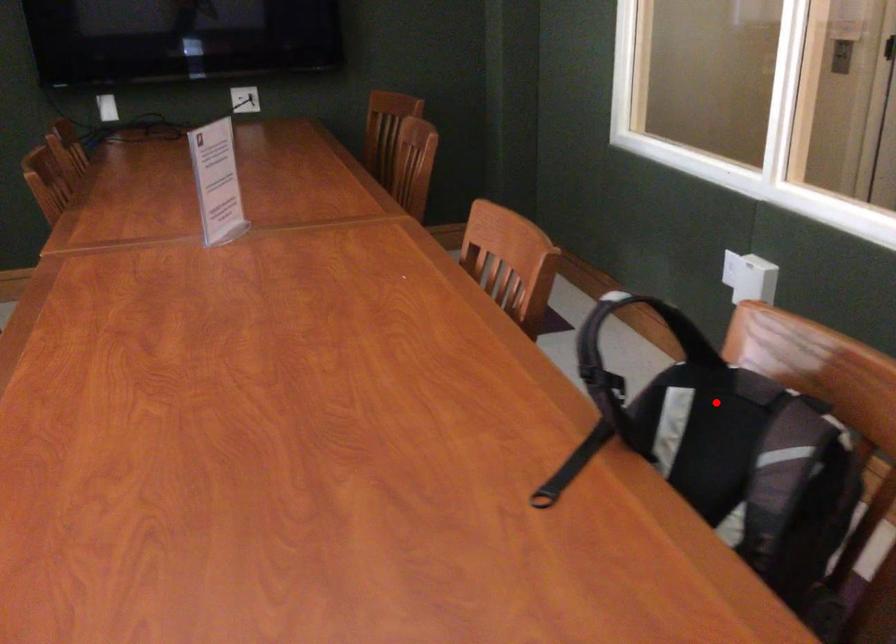
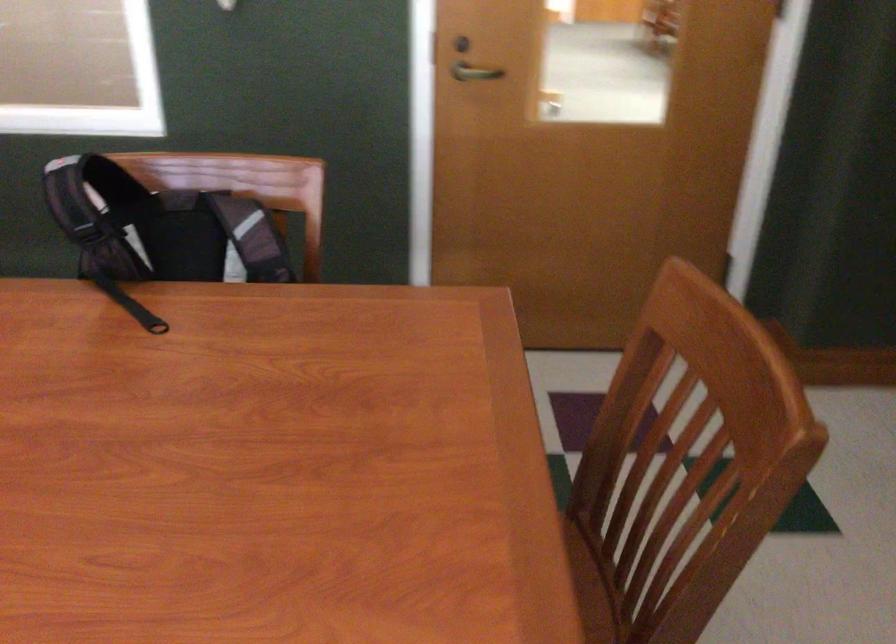
Question: I am providing you with two images of the same scene from different viewpoints. Image1 has a red point marked. In image2, the corresponding 3D location appears at what relative position? Reply with the corresponding letter.

Choices:
 (A) Closer
 (B) Farther

Answer: (B)